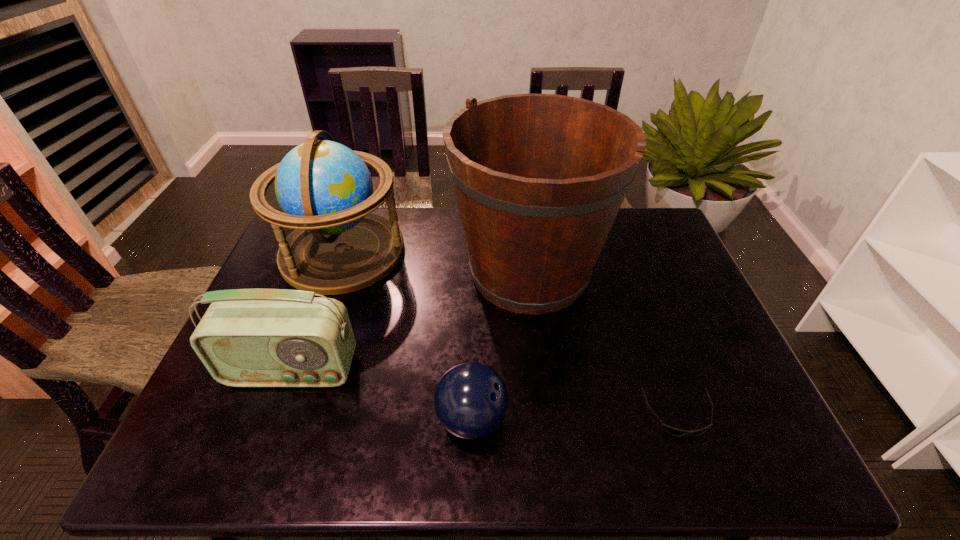
Identify the location of the tallest object. Image resolution: width=960 pixels, height=540 pixels. (539, 179).

Where is `the second tallest object`? the second tallest object is located at coordinates (324, 188).

The width and height of the screenshot is (960, 540). Identify the location of radio receiver. (247, 337).

Image resolution: width=960 pixels, height=540 pixels. I want to click on bowling ball, so click(x=471, y=400).

Find the location of a particular element. This screenshot has height=540, width=960. sunglasses is located at coordinates (674, 431).

The image size is (960, 540). Find the location of `vacant area situated 0.060m on the right of the tallest object`. vacant area situated 0.060m on the right of the tallest object is located at coordinates (627, 273).

Where is `free space located 0.080m on the right of the globe`? The width and height of the screenshot is (960, 540). free space located 0.080m on the right of the globe is located at coordinates (x=429, y=252).

The image size is (960, 540). In order to click on vacant area situated 0.150m on the front panel of the radio receiver in this screenshot , I will do `click(261, 453)`.

The width and height of the screenshot is (960, 540). I want to click on free region located 0.400m on the surface of the second shortest object near the finger holes, so [685, 420].

I want to click on vacant space positioned on the front-facing side of the sunglasses, so click(x=699, y=470).